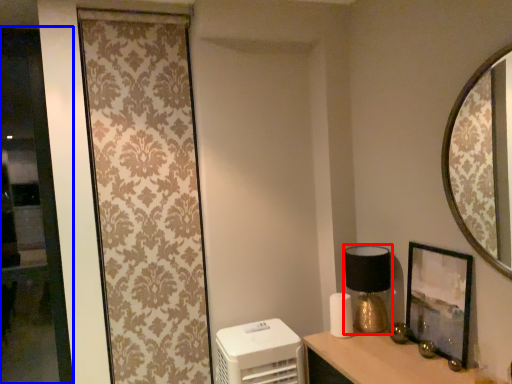
Question: Among these objects, which one is nearest to the camera, table lamp (highlighted by a red box) or glass door (highlighted by a blue box)?

Choices:
 (A) table lamp
 (B) glass door

Answer: (A)